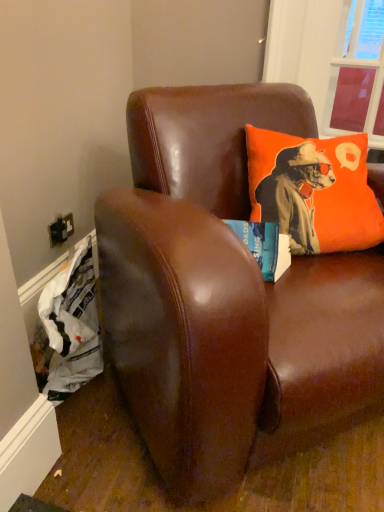
Question: From the image's perspective, would you say orange fabric pillow at upper right is positioned over transparent plastic window screen at upper right?

Choices:
 (A) no
 (B) yes

Answer: (A)

Question: Is orange fabric pillow at upper right smaller than transparent plastic window screen at upper right?

Choices:
 (A) yes
 (B) no

Answer: (B)

Question: Is orange fabric pillow at upper right not close to transparent plastic window screen at upper right?

Choices:
 (A) yes
 (B) no

Answer: (A)

Question: Considering the relative sizes of orange fabric pillow at upper right and transparent plastic window screen at upper right in the image provided, is orange fabric pillow at upper right wider than transparent plastic window screen at upper right?

Choices:
 (A) no
 (B) yes

Answer: (B)

Question: Is orange fabric pillow at upper right positioned beyond the bounds of transparent plastic window screen at upper right?

Choices:
 (A) yes
 (B) no

Answer: (A)

Question: From a real-world perspective, is orange fabric pillow at upper right on transparent plastic window screen at upper right?

Choices:
 (A) yes
 (B) no

Answer: (B)

Question: From a real-world perspective, is transparent plastic window screen at upper right located higher than orange fabric pillow at upper right?

Choices:
 (A) no
 (B) yes

Answer: (B)

Question: Is transparent plastic window screen at upper right not inside orange fabric pillow at upper right?

Choices:
 (A) no
 (B) yes

Answer: (B)

Question: Is transparent plastic window screen at upper right shorter than orange fabric pillow at upper right?

Choices:
 (A) yes
 (B) no

Answer: (B)

Question: Does transparent plastic window screen at upper right appear on the left side of orange fabric pillow at upper right?

Choices:
 (A) yes
 (B) no

Answer: (B)

Question: Does transparent plastic window screen at upper right come behind orange fabric pillow at upper right?

Choices:
 (A) no
 (B) yes

Answer: (B)

Question: From a real-world perspective, is transparent plastic window screen at upper right physically below orange fabric pillow at upper right?

Choices:
 (A) no
 (B) yes

Answer: (A)

Question: Is transparent plastic window screen at upper right taller than brown leather couch at upper center?

Choices:
 (A) no
 (B) yes

Answer: (A)